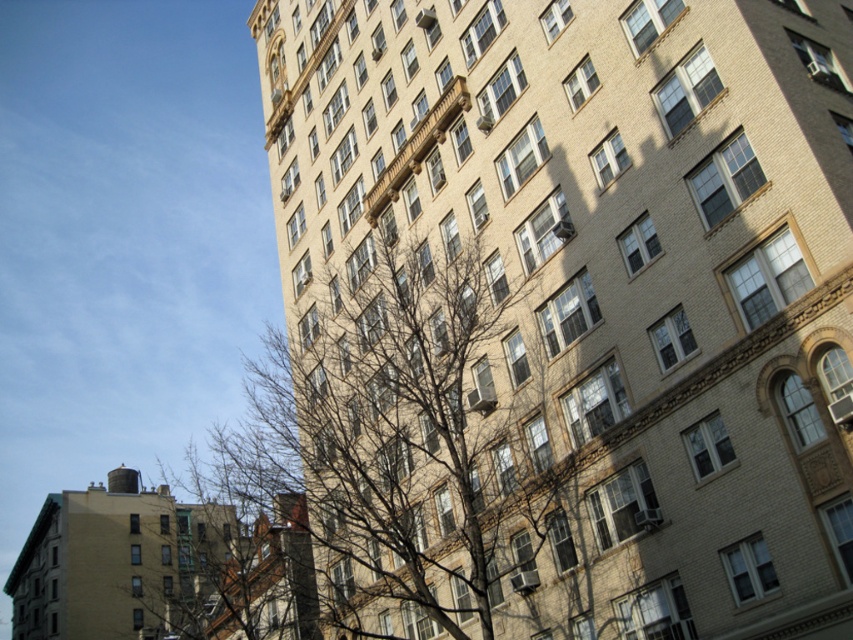
Is beige brick building at center thinner than bare branches at left?

Indeed, beige brick building at center has a lesser width compared to bare branches at left.

You are a GUI agent. You are given a task and a screenshot of the screen. Output one action in this format:
    pyautogui.click(x=<x>, y=<y>)
    Task: Click on the beige brick building at center
    This screenshot has width=853, height=640.
    Given the screenshot: What is the action you would take?
    pyautogui.click(x=602, y=280)

What do you see at coordinates (602, 280) in the screenshot?
I see `beige brick building at center` at bounding box center [602, 280].

Locate an element on the screen. The width and height of the screenshot is (853, 640). beige brick building at center is located at coordinates (602, 280).